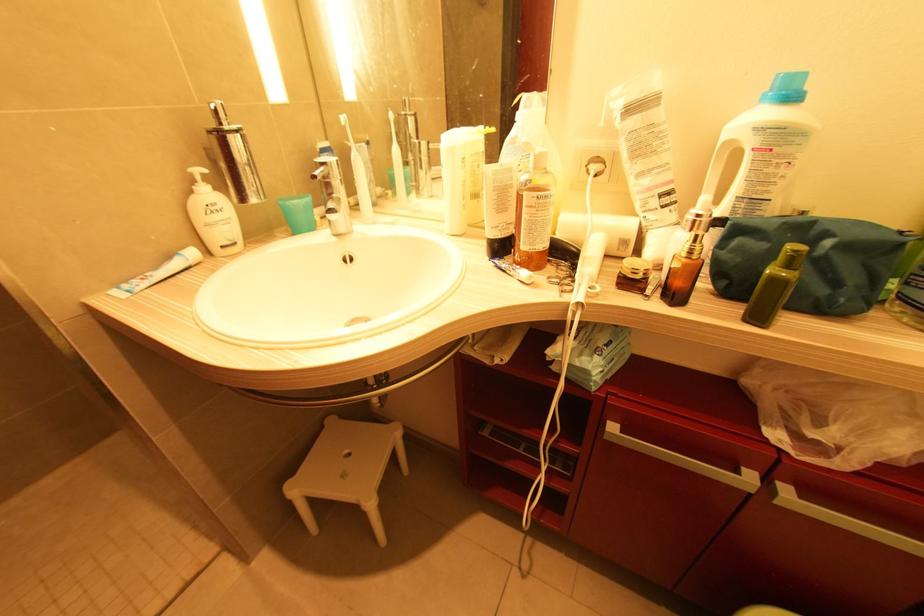
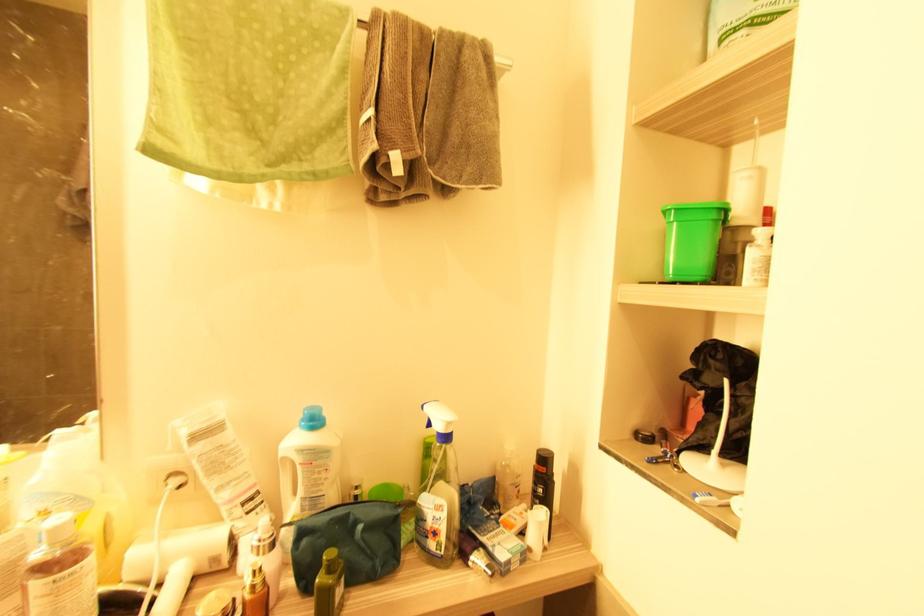
The point at (696, 223) is marked in the first image. Where is the corresponding point in the second image?

(261, 546)